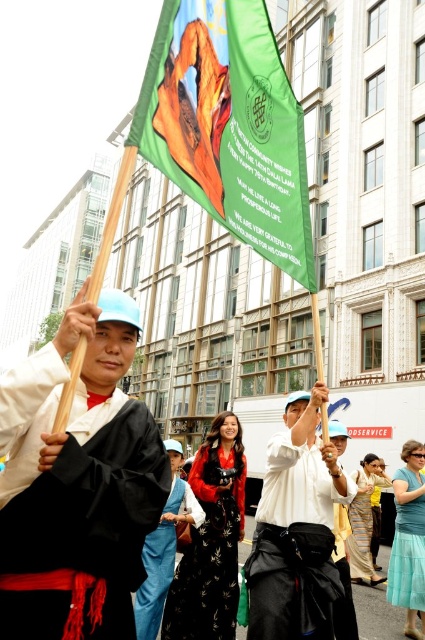
You are a photographer at the event and want to capture both the green fabric flag at upper center and the teal satin dress at lower right in a single frame. Which object should you focus on first to ensure both are in the frame?

You should focus on the green fabric flag at upper center first because it is larger in size than the teal satin dress at lower right, so it will take up more space in the frame and ensure both are visible.

You are a photographer at the event and want to capture both the matte black robe at center and the teal satin dress at lower right in a single frame. Given that your camera has a limited focus range, which of the two clothing items is larger and might require adjusting the focus settings to ensure clarity?

The matte black robe at center is bigger than the teal satin dress at lower right, so you should adjust the focus settings to accommodate the larger size of the matte black robe at center for clarity.